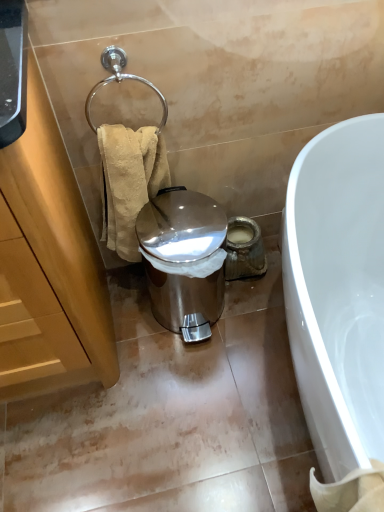
This screenshot has width=384, height=512. I want to click on beige textured towel at left, so click(129, 181).

What is the approximate height of shiny metallic trash can at center?

shiny metallic trash can at center is 15.04 inches in height.

Measure the distance between polished chrome towel ring at upper left and camera.

The distance of polished chrome towel ring at upper left from camera is 93.70 centimeters.

Measure the distance between wooden cabinet at left and camera.

wooden cabinet at left is 23.75 inches from camera.

What do you see at coordinates (338, 291) in the screenshot? The width and height of the screenshot is (384, 512). I see `white glossy bathtub at lower right` at bounding box center [338, 291].

I want to click on beige textured towel at left, so click(x=129, y=181).

Considering the positions of objects beige textured towel at left and polished chrome towel ring at upper left in the image provided, who is in front, beige textured towel at left or polished chrome towel ring at upper left?

polished chrome towel ring at upper left is in front.

Is beige textured towel at left taller or shorter than polished chrome towel ring at upper left?

Considering their sizes, beige textured towel at left has more height than polished chrome towel ring at upper left.

Is beige textured towel at left smaller than polished chrome towel ring at upper left?

Incorrect, beige textured towel at left is not smaller in size than polished chrome towel ring at upper left.

Does wooden cabinet at left have a lesser height compared to shiny metallic trash can at center?

Incorrect, the height of wooden cabinet at left does not fall short of that of shiny metallic trash can at center.

From the image's perspective, between wooden cabinet at left and shiny metallic trash can at center, which one is located above?

wooden cabinet at left.

From the picture: Considering the relative sizes of wooden cabinet at left and shiny metallic trash can at center in the image provided, is wooden cabinet at left thinner than shiny metallic trash can at center?

No.

Find the location of a particular element. Image resolution: width=384 pixels, height=512 pixels. shower on the left of the white glossy bathtub at lower right is located at coordinates (120, 81).

Would you say polished chrome towel ring at upper left is to the left or to the right of white glossy bathtub at lower right in the picture?

Based on their positions, polished chrome towel ring at upper left is located to the left of white glossy bathtub at lower right.

Which is behind, point (115, 72) or point (338, 256)?

The point (338, 256) is behind.

From the image's perspective, which one is positioned lower, polished chrome towel ring at upper left or white glossy bathtub at lower right?

white glossy bathtub at lower right, from the image's perspective.

Considering the sizes of objects shiny metallic trash can at center and white glossy bathtub at lower right in the image provided, who is smaller, shiny metallic trash can at center or white glossy bathtub at lower right?

shiny metallic trash can at center is smaller.

How distant is shiny metallic trash can at center from white glossy bathtub at lower right?

A distance of 37.85 centimeters exists between shiny metallic trash can at center and white glossy bathtub at lower right.

Does shiny metallic trash can at center have a lesser height compared to white glossy bathtub at lower right?

Yes.

From a real-world perspective, between shiny metallic trash can at center and white glossy bathtub at lower right, who is vertically lower?

shiny metallic trash can at center.

In terms of width, does shiny metallic trash can at center look wider or thinner when compared to beige textured towel at left?

shiny metallic trash can at center is wider than beige textured towel at left.

From the image's perspective, would you say shiny metallic trash can at center is shown under beige textured towel at left?

Yes, from the image's perspective, shiny metallic trash can at center is below beige textured towel at left.

In the scene shown: Measure the distance from shiny metallic trash can at center to beige textured towel at left.

shiny metallic trash can at center is 15.24 centimeters from beige textured towel at left.

Which is more to the right, shiny metallic trash can at center or beige textured towel at left?

Positioned to the right is shiny metallic trash can at center.

Is white glossy bathtub at lower right looking in the opposite direction of polished chrome towel ring at upper left?

white glossy bathtub at lower right is not turned away from polished chrome towel ring at upper left.

Between point (320, 156) and point (105, 78), which one is positioned behind?

Positioned behind is point (320, 156).

Who is bigger, white glossy bathtub at lower right or polished chrome towel ring at upper left?

white glossy bathtub at lower right.

From the image's perspective, which one is positioned higher, polished chrome towel ring at upper left or beige textured towel at left?

polished chrome towel ring at upper left appears higher in the image.

Is polished chrome towel ring at upper left in front of or behind beige textured towel at left in the image?

polished chrome towel ring at upper left is positioned closer to the viewer than beige textured towel at left.

You are a GUI agent. You are given a task and a screenshot of the screen. Output one action in this format:
    pyautogui.click(x=<x>, y=<y>)
    Task: Click on the shower lying on the right of beige textured towel at left
    The height and width of the screenshot is (512, 384).
    Given the screenshot: What is the action you would take?
    pyautogui.click(x=120, y=81)

Where is `towel/napkin behind the polished chrome towel ring at upper left`? towel/napkin behind the polished chrome towel ring at upper left is located at coordinates (129, 181).

Locate an element on the screen. Image resolution: width=384 pixels, height=512 pixels. cabinetry above the shiny metallic trash can at center (from a real-world perspective) is located at coordinates (50, 266).

When comparing their distances from polished chrome towel ring at upper left, does wooden cabinet at left or shiny metallic trash can at center seem closer?

shiny metallic trash can at center lies closer to polished chrome towel ring at upper left than the other object.

When comparing their distances from polished chrome towel ring at upper left, does beige textured towel at left or shiny metallic trash can at center seem closer?

Among the two, beige textured towel at left is located nearer to polished chrome towel ring at upper left.

Based on their spatial positions, is shiny metallic trash can at center or wooden cabinet at left further from beige textured towel at left?

wooden cabinet at left is further to beige textured towel at left.

Estimate the real-world distances between objects in this image. Which object is further from beige textured towel at left, wooden cabinet at left or shiny metallic trash can at center?

wooden cabinet at left.

Estimate the real-world distances between objects in this image. Which object is further from beige textured towel at left, polished chrome towel ring at upper left or shiny metallic trash can at center?

polished chrome towel ring at upper left.

Estimate the real-world distances between objects in this image. Which object is further from white glossy bathtub at lower right, shiny metallic trash can at center or beige textured towel at left?

The object further to white glossy bathtub at lower right is beige textured towel at left.

Which object lies further to the anchor point white glossy bathtub at lower right, polished chrome towel ring at upper left or beige textured towel at left?

polished chrome towel ring at upper left.

When comparing their distances from white glossy bathtub at lower right, does wooden cabinet at left or polished chrome towel ring at upper left seem closer?

wooden cabinet at left is closer to white glossy bathtub at lower right.

Locate an element on the screen. towel/napkin between polished chrome towel ring at upper left and shiny metallic trash can at center from top to bottom is located at coordinates (129, 181).

The width and height of the screenshot is (384, 512). Find the location of `shower positioned between wooden cabinet at left and shiny metallic trash can at center from near to far`. shower positioned between wooden cabinet at left and shiny metallic trash can at center from near to far is located at coordinates (120, 81).

Locate an element on the screen. The image size is (384, 512). trash bin/can situated between polished chrome towel ring at upper left and white glossy bathtub at lower right from left to right is located at coordinates (184, 260).

Identify the location of shower located between wooden cabinet at left and white glossy bathtub at lower right in the left-right direction. (x=120, y=81).